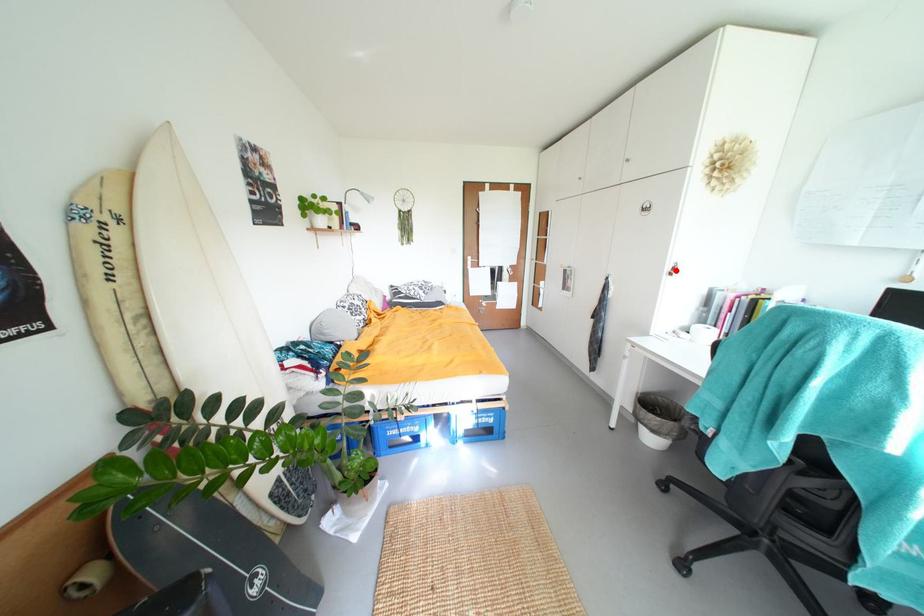
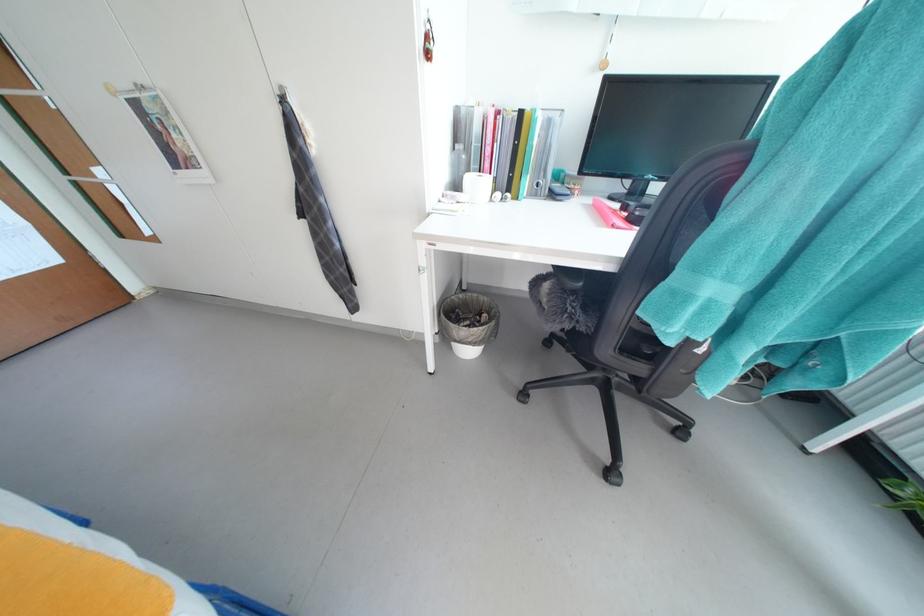
Locate, in the second image, the point that corresponds to the highlighted location in the first image.

(428, 41)